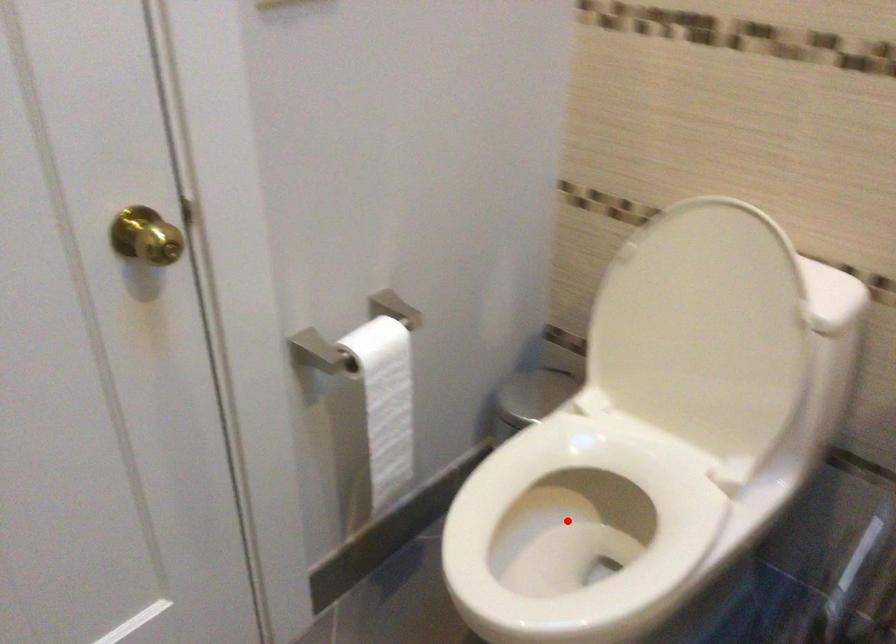
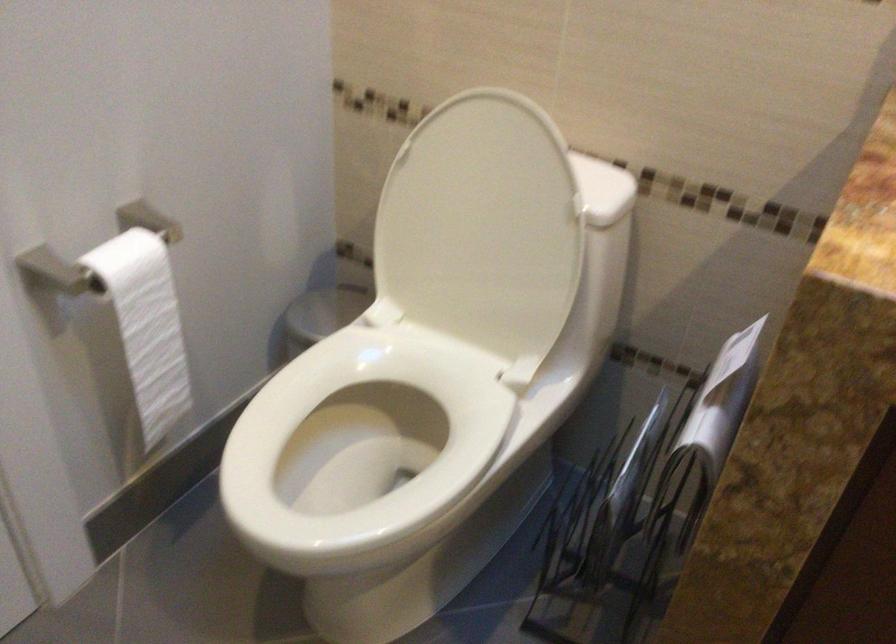
Locate, in the second image, the point that corresponds to the highlighted location in the first image.

(363, 438)